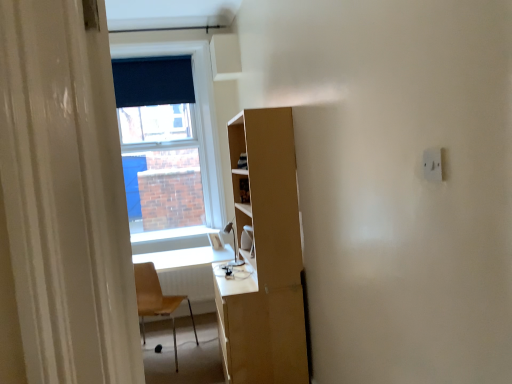
Question: Does white glossy computer desk at center appear on the left side of white glossy window sill at center?

Choices:
 (A) no
 (B) yes

Answer: (A)

Question: Is white glossy computer desk at center bigger than white glossy window sill at center?

Choices:
 (A) yes
 (B) no

Answer: (A)

Question: Can we say white glossy computer desk at center lies outside white glossy window sill at center?

Choices:
 (A) no
 (B) yes

Answer: (B)

Question: Is white glossy computer desk at center turned away from white glossy window sill at center?

Choices:
 (A) yes
 (B) no

Answer: (A)

Question: Is white glossy computer desk at center further to the viewer compared to white glossy window sill at center?

Choices:
 (A) no
 (B) yes

Answer: (A)

Question: From the image's perspective, is white plastic electric outlet at upper right positioned above or below light brown plastic chair at lower left?

Choices:
 (A) below
 (B) above

Answer: (B)

Question: In terms of height, does white plastic electric outlet at upper right look taller or shorter compared to light brown plastic chair at lower left?

Choices:
 (A) tall
 (B) short

Answer: (B)

Question: Is white plastic electric outlet at upper right wider or thinner than light brown plastic chair at lower left?

Choices:
 (A) thin
 (B) wide

Answer: (A)

Question: Looking at the image, does white plastic electric outlet at upper right seem bigger or smaller compared to light brown plastic chair at lower left?

Choices:
 (A) big
 (B) small

Answer: (B)

Question: Considering their positions, is dark blue fabric at upper center located in front of or behind white glossy window sill at center?

Choices:
 (A) front
 (B) behind

Answer: (B)

Question: Would you say dark blue fabric at upper center is to the left or to the right of white glossy window sill at center in the picture?

Choices:
 (A) left
 (B) right

Answer: (A)

Question: Considering the positions of dark blue fabric at upper center and white glossy window sill at center in the image, is dark blue fabric at upper center wider or thinner than white glossy window sill at center?

Choices:
 (A) wide
 (B) thin

Answer: (B)

Question: In terms of size, does dark blue fabric at upper center appear bigger or smaller than white glossy window sill at center?

Choices:
 (A) big
 (B) small

Answer: (A)

Question: In terms of width, does white plastic electric outlet at upper right look wider or thinner when compared to dark blue fabric at upper center?

Choices:
 (A) thin
 (B) wide

Answer: (A)

Question: Is white plastic electric outlet at upper right inside the boundaries of dark blue fabric at upper center, or outside?

Choices:
 (A) outside
 (B) inside

Answer: (A)